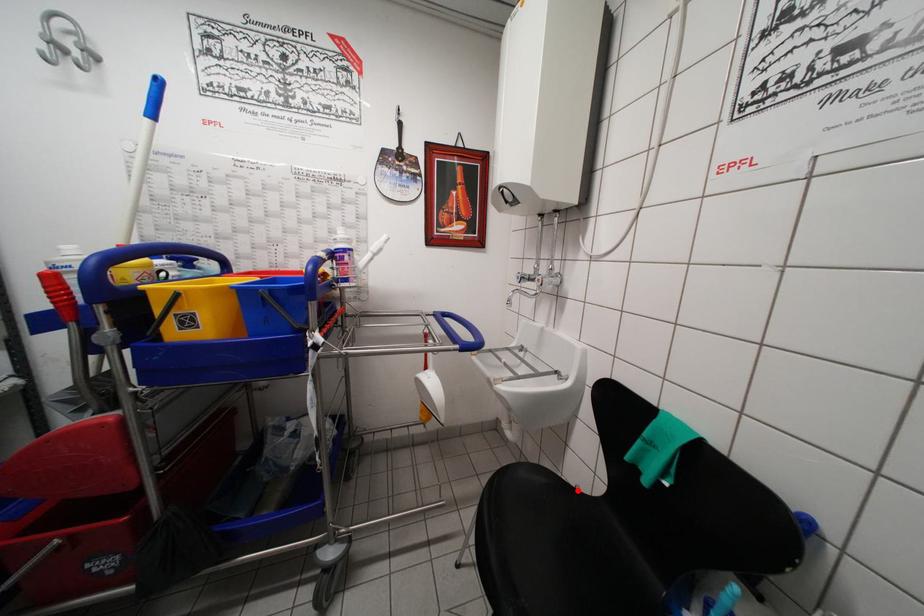
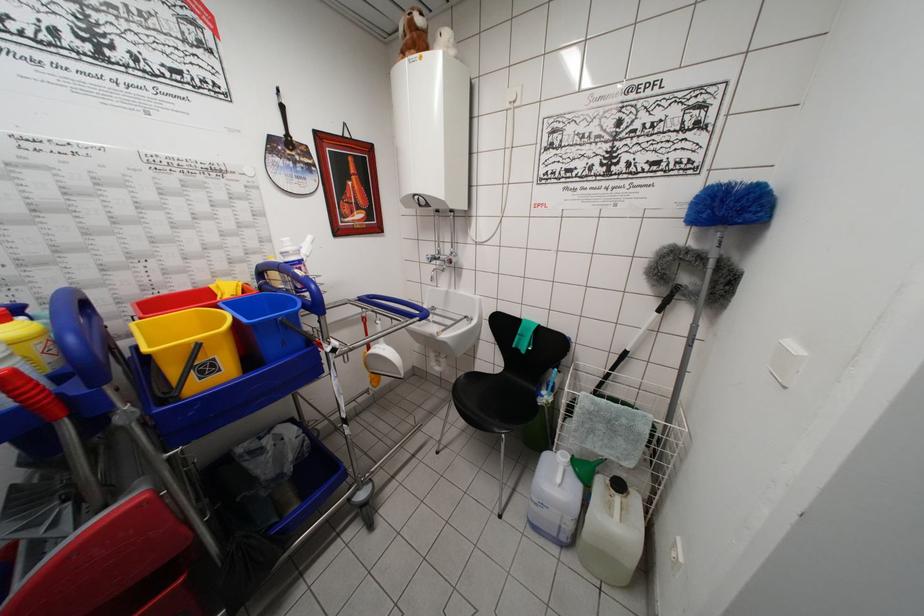
Question: I am providing you with two images of the same scene from different viewpoints. Given a red point in image1, look at the same physical point in image2. Is it:

Choices:
 (A) Closer to the viewpoint
 (B) Farther from the viewpoint

Answer: (B)